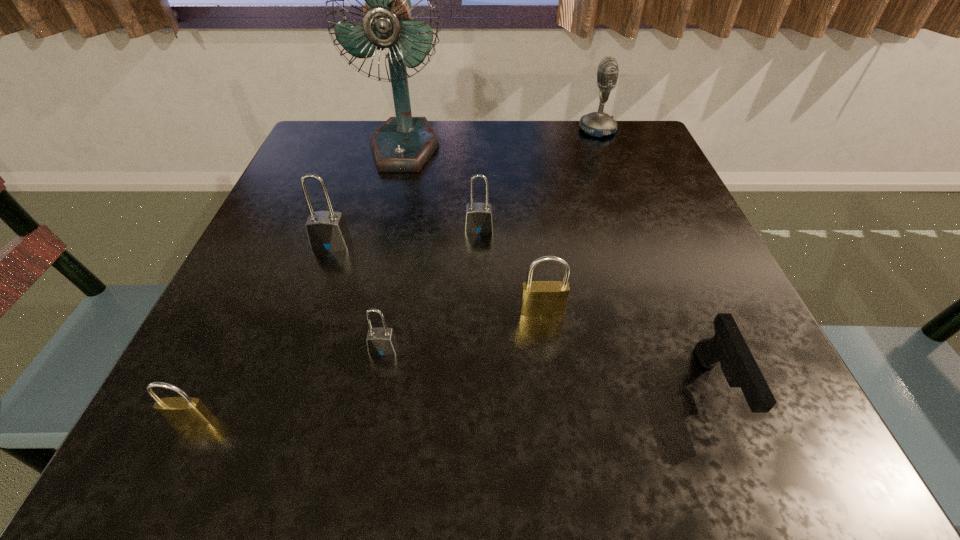
At what (x,y) coordinates should I click in order to perform the action: click on free region located 0.060m on the front-facing side of the fifth farthest object. Please return your answer as a coordinate pair (x, y). This screenshot has height=540, width=960. Looking at the image, I should click on (547, 349).

The image size is (960, 540). I want to click on vacant space situated 0.140m on the shackle of the nearest gray padlock, so [365, 451].

You are a GUI agent. You are given a task and a screenshot of the screen. Output one action in this format:
    pyautogui.click(x=<x>, y=<y>)
    Task: Click on the free point located on the front-facing side of the leftmost padlock
    The width and height of the screenshot is (960, 540).
    Given the screenshot: What is the action you would take?
    pyautogui.click(x=171, y=465)

Where is `fan at the far edge`? This screenshot has width=960, height=540. fan at the far edge is located at coordinates click(x=403, y=143).

Where is `microphone that is at the far edge`? The height and width of the screenshot is (540, 960). microphone that is at the far edge is located at coordinates (597, 124).

Find the location of a particular element. pistol that is at the near edge is located at coordinates (727, 347).

Locate an element on the screen. The width and height of the screenshot is (960, 540). padlock present at the near edge is located at coordinates (183, 411).

I want to click on fan that is at the left edge, so click(x=403, y=143).

You are a GUI agent. You are given a task and a screenshot of the screen. Output one action in this format:
    pyautogui.click(x=<x>, y=<y>)
    Task: Click on the microphone present at the right edge
    This screenshot has width=960, height=540.
    Given the screenshot: What is the action you would take?
    pyautogui.click(x=597, y=124)

The width and height of the screenshot is (960, 540). I want to click on pistol that is positioned at the right edge, so click(727, 347).